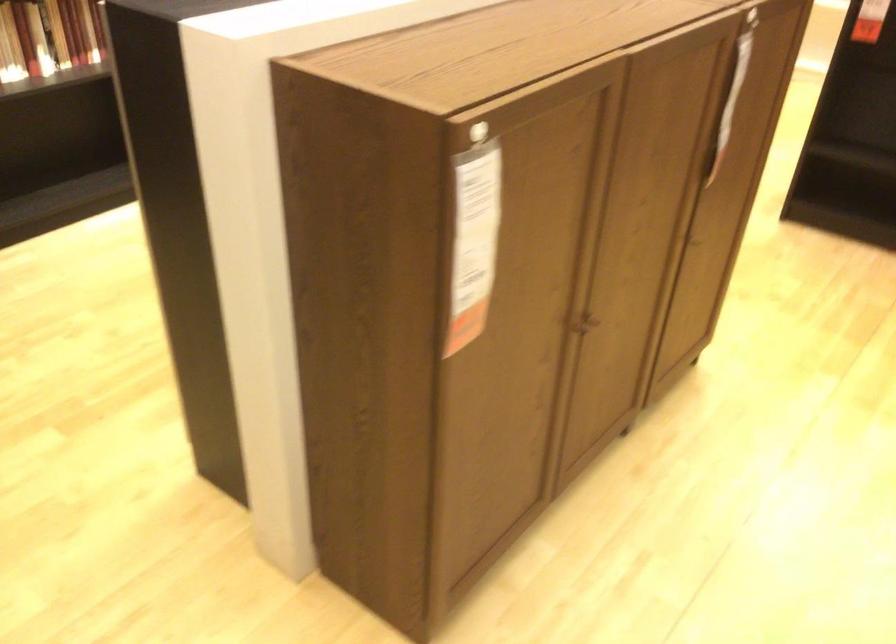
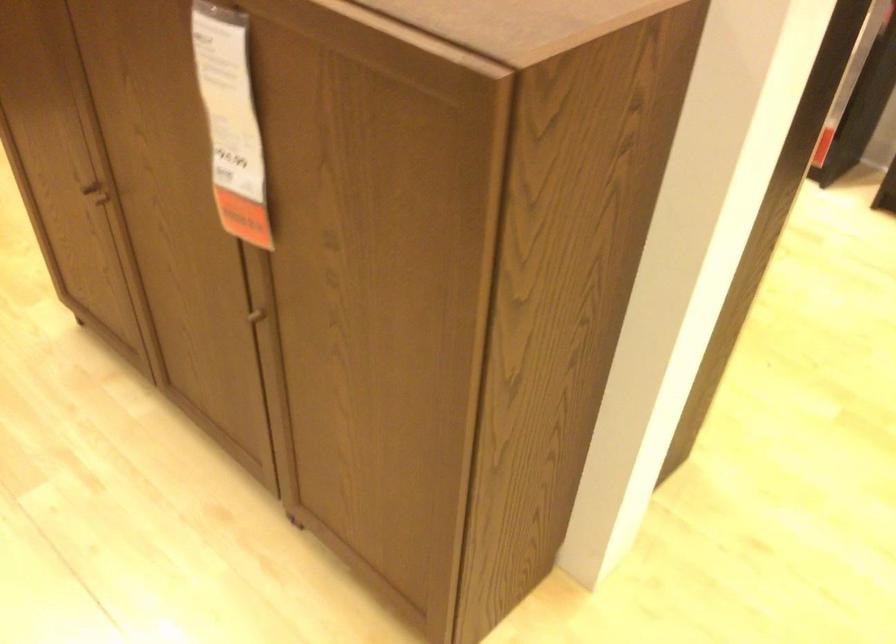
Locate, in the second image, the point that corresponds to pixel 730 96 in the first image.

(230, 122)